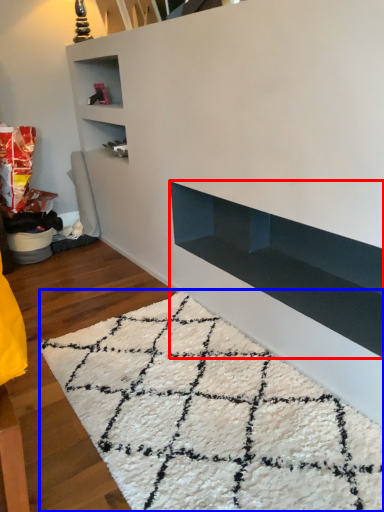
Question: Which of the following is the farthest to the observer, shelf (highlighted by a red box) or mat (highlighted by a blue box)?

Choices:
 (A) shelf
 (B) mat

Answer: (A)